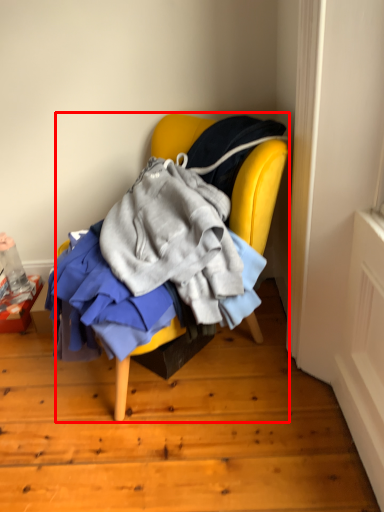
Question: From the image's perspective, what is the correct spatial relationship of chair (annotated by the red box) in relation to box?

Choices:
 (A) above
 (B) below

Answer: (A)